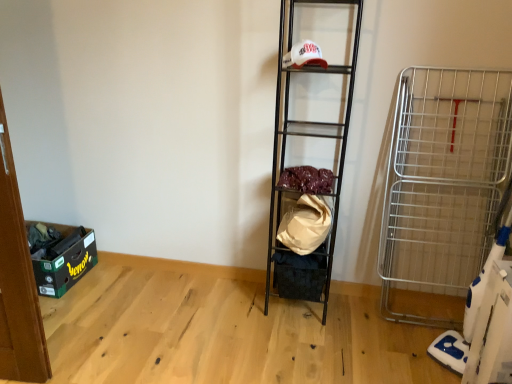
Question: In which direction should I rotate to look at black fabric storage box at center, the 1th storage box when ordered from right to left?

Choices:
 (A) right
 (B) left

Answer: (A)

Question: From the image's perspective, is velvet-like fabric at center, which appears as the second material when ordered from the bottom, located beneath silver metallic cart at right?

Choices:
 (A) yes
 (B) no

Answer: (B)

Question: Considering the relative sizes of velvet-like fabric at center, acting as the first material starting from the top, and silver metallic cart at right in the image provided, is velvet-like fabric at center, acting as the first material starting from the top, shorter than silver metallic cart at right?

Choices:
 (A) no
 (B) yes

Answer: (B)

Question: Can you confirm if velvet-like fabric at center, which appears as the second material when ordered from the bottom, is smaller than silver metallic cart at right?

Choices:
 (A) no
 (B) yes

Answer: (B)

Question: Is silver metallic cart at right inside velvet-like fabric at center, which appears as the second material when ordered from the bottom?

Choices:
 (A) no
 (B) yes

Answer: (A)

Question: From the image's perspective, is velvet-like fabric at center, which appears as the second material when ordered from the bottom, located above silver metallic cart at right?

Choices:
 (A) yes
 (B) no

Answer: (A)

Question: Is velvet-like fabric at center, acting as the first material starting from the top, further to camera compared to silver metallic cart at right?

Choices:
 (A) no
 (B) yes

Answer: (B)

Question: Does metallic black shelf at center have a larger size compared to black fabric storage box at center, the second storage box in the left-to-right sequence?

Choices:
 (A) no
 (B) yes

Answer: (B)

Question: From the image's perspective, is metallic black shelf at center beneath black fabric storage box at center, the second storage box in the left-to-right sequence?

Choices:
 (A) no
 (B) yes

Answer: (A)

Question: From the image's perspective, does metallic black shelf at center appear higher than black fabric storage box at center, the 1th storage box when ordered from right to left?

Choices:
 (A) no
 (B) yes

Answer: (B)

Question: Is the depth of metallic black shelf at center greater than that of black fabric storage box at center, the 1th storage box when ordered from right to left?

Choices:
 (A) yes
 (B) no

Answer: (B)

Question: Are metallic black shelf at center and black fabric storage box at center, the 1th storage box when ordered from right to left, beside each other?

Choices:
 (A) no
 (B) yes

Answer: (A)

Question: Is metallic black shelf at center closer to the viewer compared to black fabric storage box at center, the 1th storage box when ordered from right to left?

Choices:
 (A) no
 (B) yes

Answer: (B)

Question: Is green cardboard storage box at lower left, placed as the 1th storage box when sorted from left to right, placed right next to beige fabric bag at center, which ranks as the 2th material in top-to-bottom order?

Choices:
 (A) yes
 (B) no

Answer: (B)